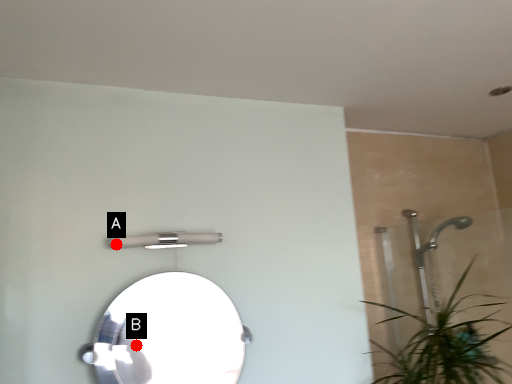
Question: Two points are circled on the image, labeled by A and B beside each circle. Which point is farther from the camera taking this photo?

Choices:
 (A) A is further
 (B) B is further

Answer: (A)